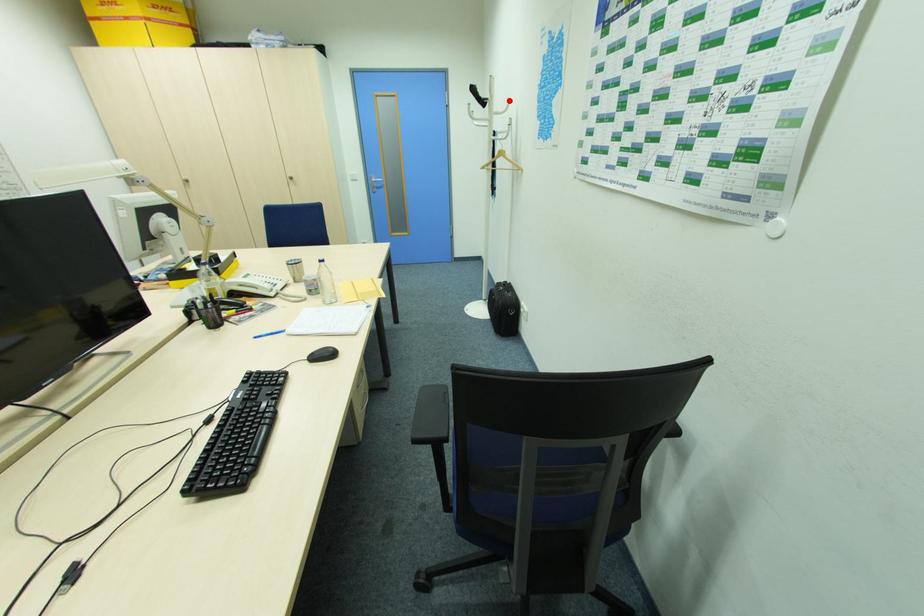
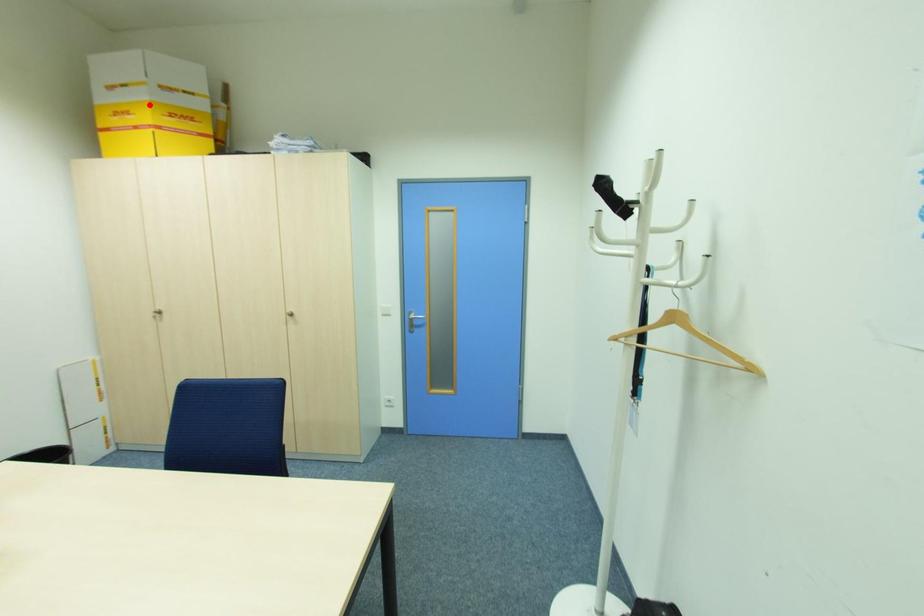
I am providing you with two images of the same scene from different viewpoints. A red point is marked on the first image and another point is marked on the second image. Does the point marked in image1 correspond to the same location as the one in image2?

No